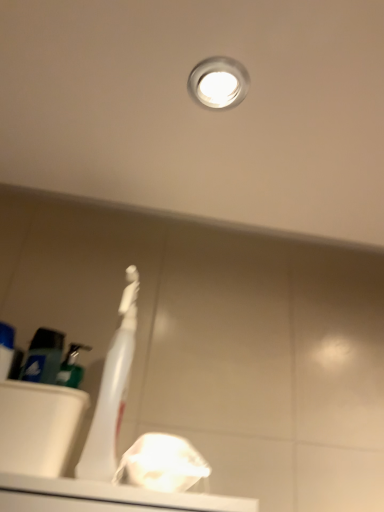
Locate an element on the screen. This screenshot has height=512, width=384. white plastic toothbrush at center is located at coordinates click(112, 391).

You are a GUI agent. You are given a task and a screenshot of the screen. Output one action in this format:
    pyautogui.click(x=<x>, y=<y>)
    Task: Click on the white glossy droplight at upper center
    This screenshot has width=384, height=512.
    Given the screenshot: What is the action you would take?
    pyautogui.click(x=218, y=83)

Locate an element on the screen. Image resolution: width=384 pixels, height=512 pixels. blue matte toothpaste tube at left is located at coordinates (6, 349).

Is blue matte toothpaste tube at left in contact with white glossy droplight at upper center?

No, blue matte toothpaste tube at left is not making contact with white glossy droplight at upper center.

Looking at this image, between blue matte toothpaste tube at left and white glossy droplight at upper center, which one has larger width?

white glossy droplight at upper center.

Considering the positions of objects blue matte toothpaste tube at left and white glossy droplight at upper center in the image provided, who is behind, blue matte toothpaste tube at left or white glossy droplight at upper center?

blue matte toothpaste tube at left is more distant.

From the picture: Can you confirm if blue matte toothpaste tube at left is taller than white glossy droplight at upper center?

Indeed, blue matte toothpaste tube at left has a greater height compared to white glossy droplight at upper center.

Could you tell me if white glossy droplight at upper center is facing blue matte toothpaste tube at left?

No, white glossy droplight at upper center does not turn towards blue matte toothpaste tube at left.

Which of these two, white glossy droplight at upper center or blue matte toothpaste tube at left, is bigger?

Bigger between the two is blue matte toothpaste tube at left.

From the image's perspective, is white glossy droplight at upper center on blue matte toothpaste tube at left?

Yes, from the image's perspective, white glossy droplight at upper center is above blue matte toothpaste tube at left.

Is white glossy droplight at upper center touching blue matte toothpaste tube at left?

white glossy droplight at upper center and blue matte toothpaste tube at left are not in contact.

Which of these two, white plastic toothbrush at center or white glossy droplight at upper center, is bigger?

With larger size is white plastic toothbrush at center.

What's the angular difference between white plastic toothbrush at center and white glossy droplight at upper center's facing directions?

There is a 91-degree angle between the facing directions of white plastic toothbrush at center and white glossy droplight at upper center.

From the picture: Does white plastic toothbrush at center appear on the left side of white glossy droplight at upper center?

Indeed, white plastic toothbrush at center is positioned on the left side of white glossy droplight at upper center.

Is white plastic toothbrush at center at the back of blue matte toothpaste tube at left?

No, blue matte toothpaste tube at left's orientation is not away from white plastic toothbrush at center.

Are blue matte toothpaste tube at left and white plastic toothbrush at center located far from each other?

They are positioned close to each other.

Locate an element on the screen. The image size is (384, 512). toothbrush on the right of blue matte toothpaste tube at left is located at coordinates (112, 391).

Does blue matte toothpaste tube at left have a greater height compared to white plastic toothbrush at center?

In fact, blue matte toothpaste tube at left may be shorter than white plastic toothbrush at center.

Is white plastic sink at lower left oriented towards white glossy droplight at upper center?

No, white plastic sink at lower left is not aimed at white glossy droplight at upper center.

Considering the relative sizes of white plastic sink at lower left and white glossy droplight at upper center in the image provided, is white plastic sink at lower left smaller than white glossy droplight at upper center?

No.

Considering the sizes of white plastic sink at lower left and white glossy droplight at upper center in the image, is white plastic sink at lower left wider or thinner than white glossy droplight at upper center?

In the image, white plastic sink at lower left appears to be more narrow than white glossy droplight at upper center.

Is white plastic sink at lower left located outside white glossy droplight at upper center?

Indeed, white plastic sink at lower left is completely outside white glossy droplight at upper center.

From the image's perspective, who appears lower, blue matte toothpaste tube at left or white plastic sink at lower left?

white plastic sink at lower left appears lower in the image.

Considering the relative positions of blue matte toothpaste tube at left and white plastic sink at lower left in the image provided, is blue matte toothpaste tube at left to the left or to the right of white plastic sink at lower left?

Based on their positions, blue matte toothpaste tube at left is located to the left of white plastic sink at lower left.

Considering the sizes of objects blue matte toothpaste tube at left and white plastic sink at lower left in the image provided, who is taller, blue matte toothpaste tube at left or white plastic sink at lower left?

Standing taller between the two is blue matte toothpaste tube at left.

Are blue matte toothpaste tube at left and white plastic sink at lower left far apart?

No, blue matte toothpaste tube at left is not far away from white plastic sink at lower left.

Which is in front, point (238, 73) or point (25, 364)?

The point (238, 73) is closer to the camera.

Can we say white glossy droplight at upper center lies outside white plastic sink at lower left?

white glossy droplight at upper center lies outside white plastic sink at lower left's area.

Which is behind, white glossy droplight at upper center or white plastic sink at lower left?

white plastic sink at lower left.

Considering the sizes of objects white glossy droplight at upper center and white plastic sink at lower left in the image provided, who is smaller, white glossy droplight at upper center or white plastic sink at lower left?

Smaller between the two is white glossy droplight at upper center.

This screenshot has width=384, height=512. I want to click on droplight that appears on the right of blue matte toothpaste tube at left, so click(218, 83).

The height and width of the screenshot is (512, 384). In the image, there is a white glossy droplight at upper center. Identify the location of toiletry below it (from a real-world perspective). (6, 349).

Considering their positions, is white glossy droplight at upper center positioned closer to white plastic sink at lower left than blue matte toothpaste tube at left?

Based on the image, blue matte toothpaste tube at left appears to be nearer to white plastic sink at lower left.

Looking at the image, which one is located closer to white plastic toothbrush at center, white glossy droplight at upper center or white plastic sink at lower left?

white plastic sink at lower left is closer to white plastic toothbrush at center.

Estimate the real-world distances between objects in this image. Which object is closer to white plastic toothbrush at center, white plastic sink at lower left or blue matte toothpaste tube at left?

Among the two, white plastic sink at lower left is located nearer to white plastic toothbrush at center.

Considering their positions, is white plastic toothbrush at center positioned further to blue matte toothpaste tube at left than white glossy droplight at upper center?

white glossy droplight at upper center lies further to blue matte toothpaste tube at left than the other object.

From the image, which object appears to be farther from white plastic sink at lower left, white plastic toothbrush at center or blue matte toothpaste tube at left?

white plastic toothbrush at center is further to white plastic sink at lower left.

When comparing their distances from white plastic toothbrush at center, does white glossy droplight at upper center or blue matte toothpaste tube at left seem closer?

Based on the image, blue matte toothpaste tube at left appears to be nearer to white plastic toothbrush at center.

Estimate the real-world distances between objects in this image. Which object is closer to white glossy droplight at upper center, blue matte toothpaste tube at left or white plastic toothbrush at center?

The object closer to white glossy droplight at upper center is white plastic toothbrush at center.

When comparing their distances from blue matte toothpaste tube at left, does white glossy droplight at upper center or white plastic toothbrush at center seem further?

white glossy droplight at upper center is positioned further to the anchor blue matte toothpaste tube at left.

Where is `sink situated between blue matte toothpaste tube at left and white plastic toothbrush at center from left to right`? This screenshot has width=384, height=512. sink situated between blue matte toothpaste tube at left and white plastic toothbrush at center from left to right is located at coordinates (39, 412).

Where is `toothbrush between white glossy droplight at upper center and white plastic sink at lower left in the vertical direction`? The height and width of the screenshot is (512, 384). toothbrush between white glossy droplight at upper center and white plastic sink at lower left in the vertical direction is located at coordinates (112, 391).

This screenshot has width=384, height=512. I want to click on toothbrush between white glossy droplight at upper center and blue matte toothpaste tube at left in the up-down direction, so click(x=112, y=391).

The width and height of the screenshot is (384, 512). What are the coordinates of `toiletry between white glossy droplight at upper center and white plastic sink at lower left in the up-down direction` in the screenshot? It's located at (6, 349).